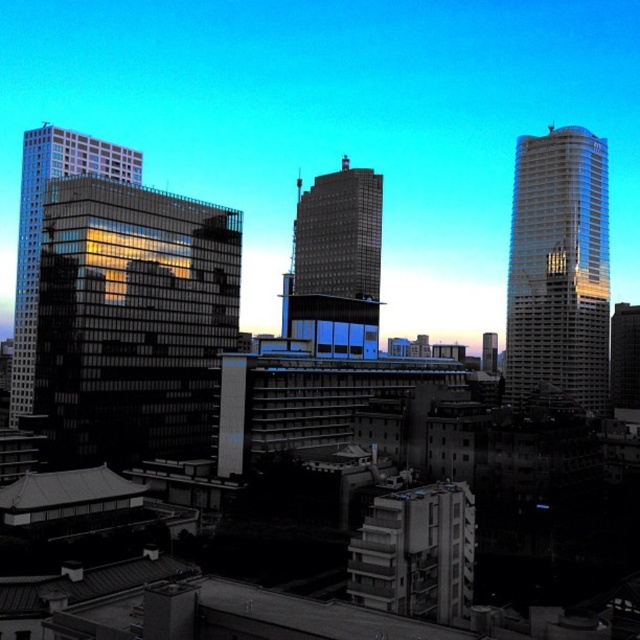
Question: Is matte glass tower at center behind reflective glass building at left?

Choices:
 (A) no
 (B) yes

Answer: (A)

Question: Does shiny glass skyscraper at right appear under reflective glass building at left?

Choices:
 (A) no
 (B) yes

Answer: (A)

Question: Which of these objects is positioned closest to the reflective glass building at left?

Choices:
 (A) shiny glass skyscraper at right
 (B) matte glass tower at center

Answer: (B)

Question: Is shiny glass skyscraper at right to the right of matte glass tower at center from the viewer's perspective?

Choices:
 (A) no
 (B) yes

Answer: (B)

Question: Which point appears farthest from the camera in this image?

Choices:
 (A) (577, 355)
 (B) (314, 252)
 (C) (36, 129)

Answer: (B)

Question: Which point is farther from the camera taking this photo?

Choices:
 (A) (593, 356)
 (B) (324, 260)

Answer: (B)